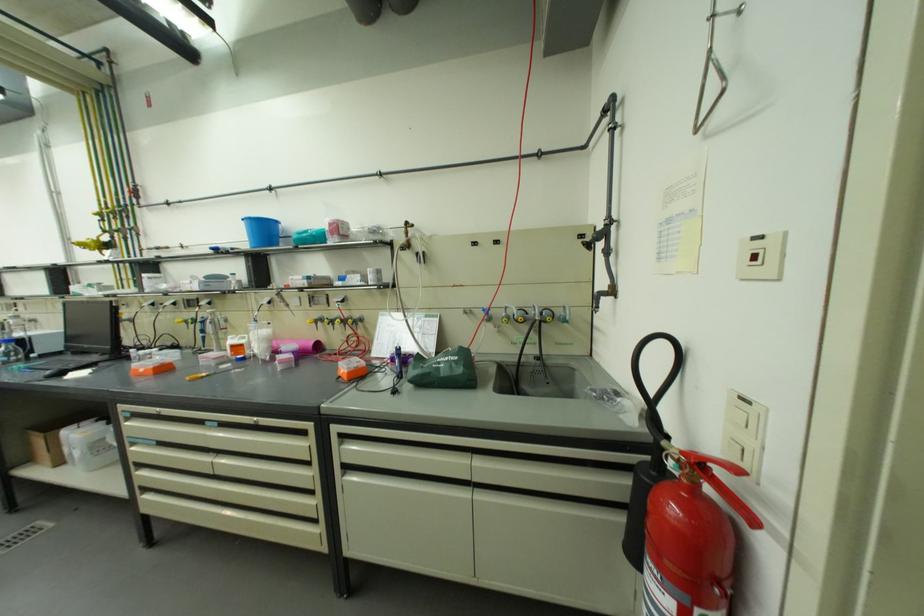
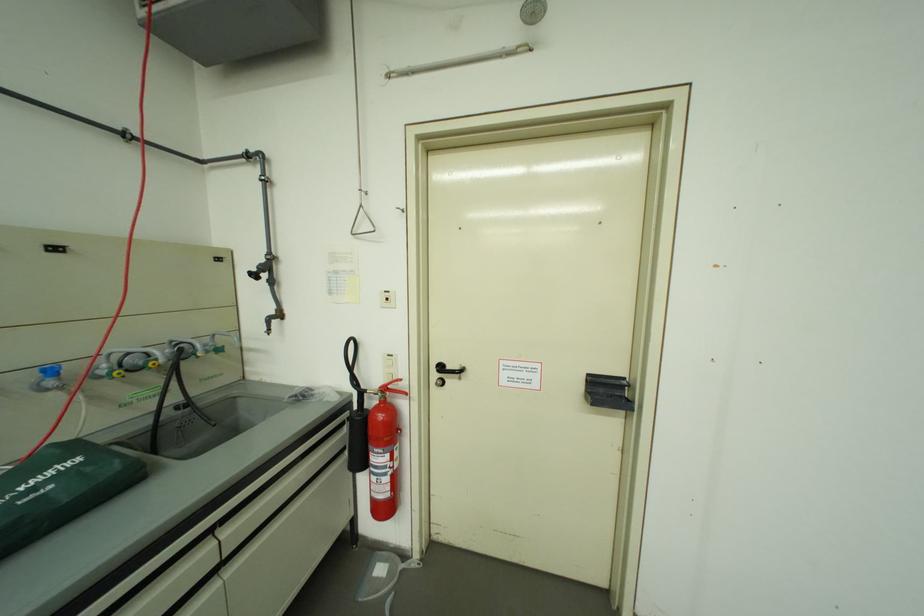
Question: Based on the continuous images, in which direction is the camera rotating? Reply with the corresponding letter.

Choices:
 (A) Left
 (B) Right
 (C) Up
 (D) Down

Answer: (B)